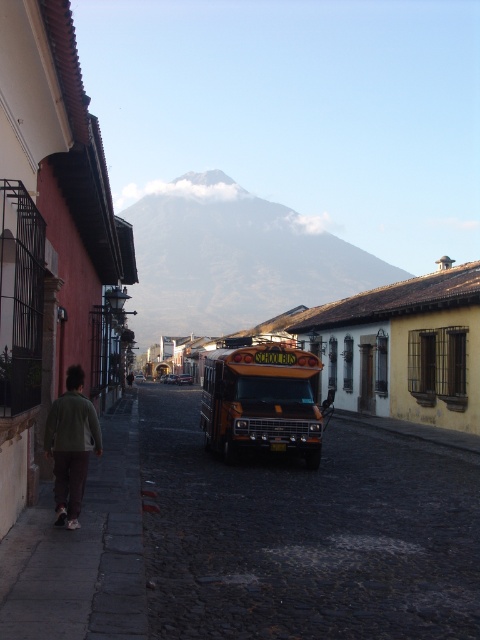
In the scene shown: You are standing at the point marked by the coordinates point (261, 401). What object is located at that point?

The point (261, 401) marks the yellow metallic school bus at center.

You are standing at the point labeled as point (305,534) in the image. What is directly beneath your feet?

The point (305,534) corresponds to cobblestone pavement at center, so the cobblestone pavement at center is directly beneath your feet.